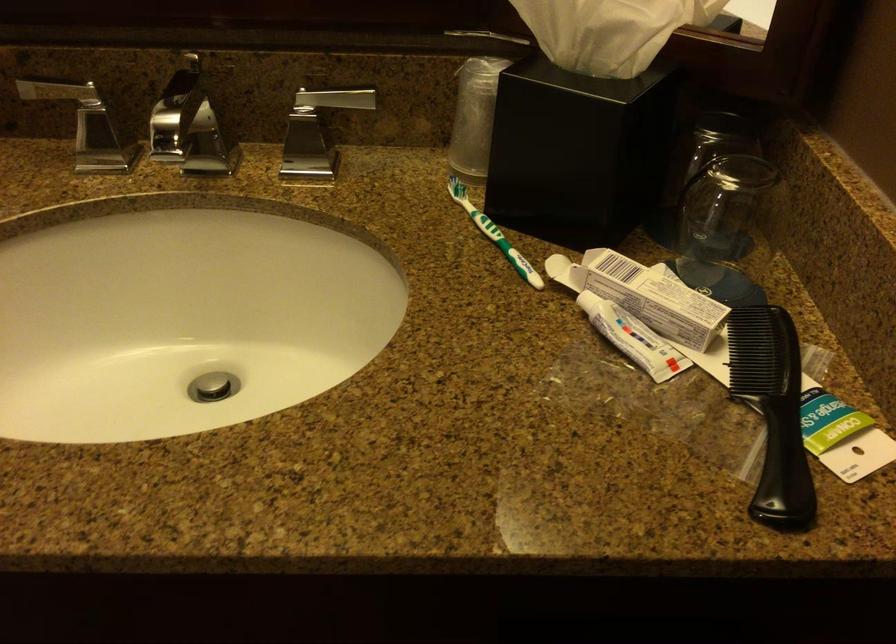
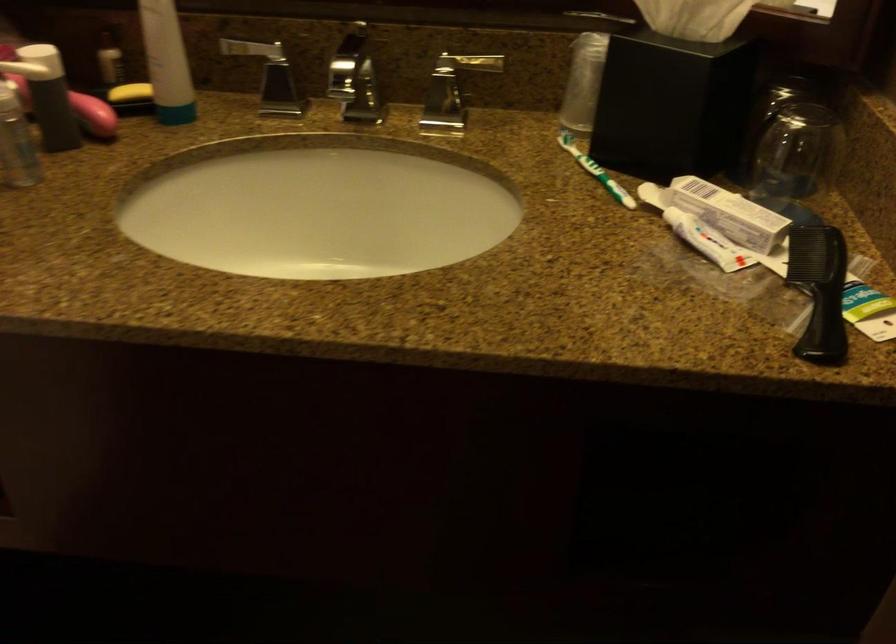
Question: In a continuous first-person perspective shot, in which direction is the camera moving?

Choices:
 (A) Left
 (B) Right
 (C) Forward
 (D) Backward

Answer: (D)